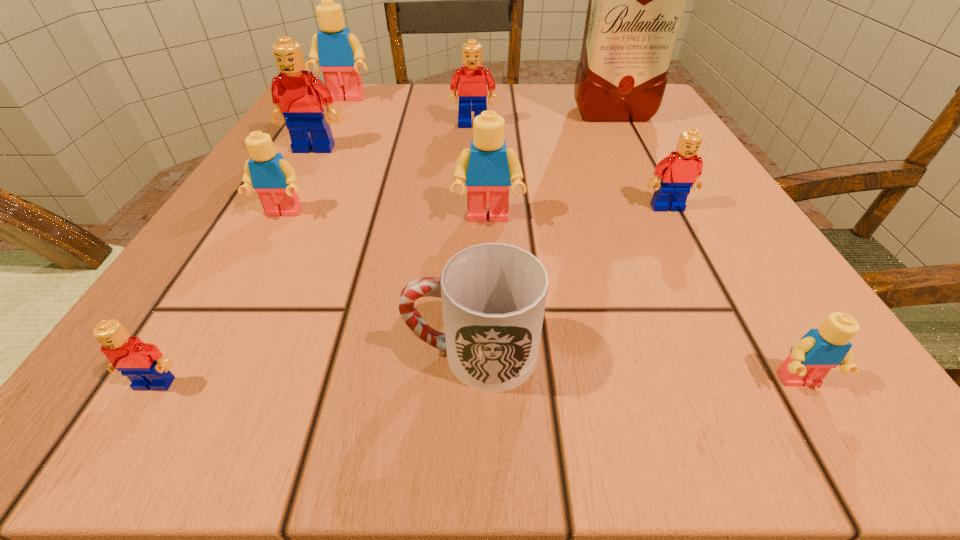
You are a GUI agent. You are given a task and a screenshot of the screen. Output one action in this format:
    pyautogui.click(x=<x>, y=<y>)
    Task: Click on the vacant point located on the front-facing side of the third biggest yellow Lego
    The height and width of the screenshot is (540, 960).
    Given the screenshot: What is the action you would take?
    pyautogui.click(x=257, y=260)

What are the coordinates of `vacant point located on the front-facing side of the third farthest red Lego` in the screenshot? It's located at (732, 332).

The width and height of the screenshot is (960, 540). I want to click on free space located 0.180m on the side of the cup where the handle is located, so click(235, 353).

You are a GUI agent. You are given a task and a screenshot of the screen. Output one action in this format:
    pyautogui.click(x=<x>, y=<y>)
    Task: Click on the free location located 0.200m on the side of the cup where the handle is located
    
    Given the screenshot: What is the action you would take?
    pyautogui.click(x=216, y=353)

This screenshot has height=540, width=960. Identify the location of vacant space located 0.080m on the side of the cup where the handle is located. (331, 353).

Find the location of a particular element. The height and width of the screenshot is (540, 960). liquor situated at the far edge is located at coordinates (637, 0).

Where is `cup located at the near edge`? cup located at the near edge is located at coordinates (493, 295).

Find the location of a particular element. The width and height of the screenshot is (960, 540). liquor that is at the right edge is located at coordinates (637, 0).

Image resolution: width=960 pixels, height=540 pixels. In order to click on object present at the far left corner in this screenshot , I will do `click(339, 53)`.

Where is `object that is at the near left corner`? object that is at the near left corner is located at coordinates pyautogui.click(x=143, y=363).